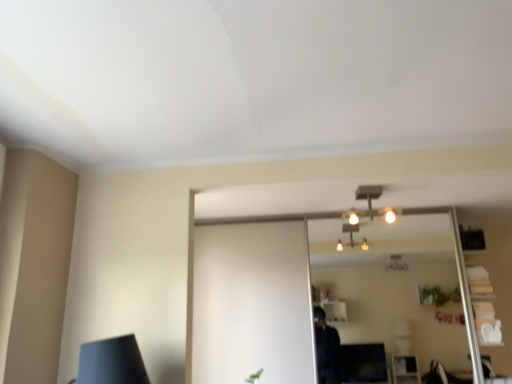
Question: From the image's perspective, is matte silver light fixture at center under clear glass mirror at center?

Choices:
 (A) yes
 (B) no

Answer: (B)

Question: Can you confirm if matte silver light fixture at center is taller than clear glass mirror at center?

Choices:
 (A) yes
 (B) no

Answer: (B)

Question: Is matte silver light fixture at center further to the viewer compared to clear glass mirror at center?

Choices:
 (A) no
 (B) yes

Answer: (A)

Question: Is matte silver light fixture at center bigger than clear glass mirror at center?

Choices:
 (A) no
 (B) yes

Answer: (A)

Question: Is matte silver light fixture at center at the left side of clear glass mirror at center?

Choices:
 (A) no
 (B) yes

Answer: (B)

Question: From a real-world perspective, is matte silver light fixture at center under clear glass mirror at center?

Choices:
 (A) yes
 (B) no

Answer: (B)

Question: Is clear glass mirror at center further to the viewer compared to matte silver light fixture at center?

Choices:
 (A) yes
 (B) no

Answer: (A)

Question: Is clear glass mirror at center far away from matte silver light fixture at center?

Choices:
 (A) no
 (B) yes

Answer: (B)

Question: Can you confirm if clear glass mirror at center is bigger than matte silver light fixture at center?

Choices:
 (A) yes
 (B) no

Answer: (A)

Question: Is the depth of clear glass mirror at center less than that of matte silver light fixture at center?

Choices:
 (A) no
 (B) yes

Answer: (A)

Question: Considering the relative sizes of clear glass mirror at center and matte silver light fixture at center in the image provided, is clear glass mirror at center wider than matte silver light fixture at center?

Choices:
 (A) no
 (B) yes

Answer: (A)

Question: Would you say clear glass mirror at center is outside matte silver light fixture at center?

Choices:
 (A) no
 (B) yes

Answer: (B)

Question: Is clear glass mirror at center inside the boundaries of matte silver light fixture at center, or outside?

Choices:
 (A) inside
 (B) outside

Answer: (B)